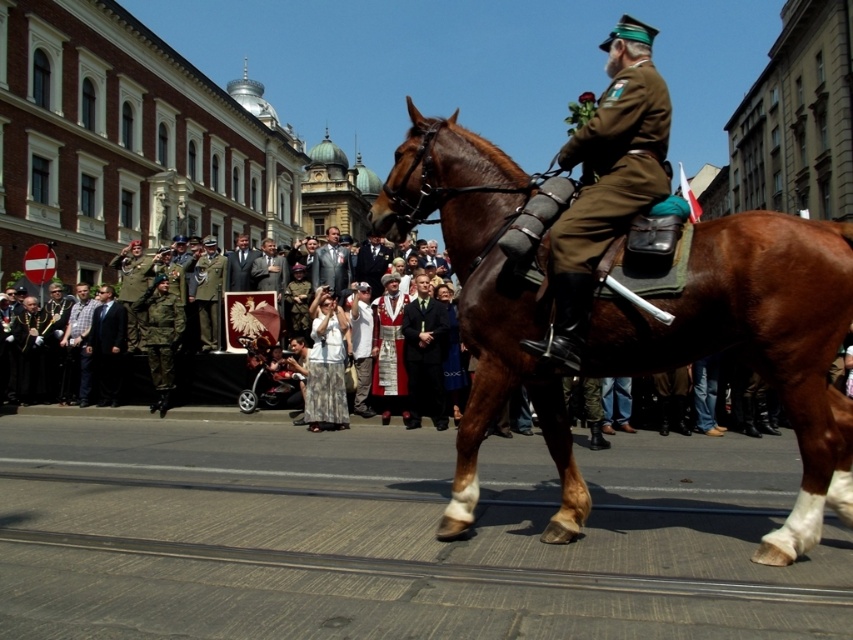
From the picture: You are standing on the sidewalk observing the mounted officer and the crowd. Which of the two points, point (463,257) or point (611,116), is closer to you?

Point (463,257) is closer to you because it is further to the viewer than point (611,116).

You are a photographer at the event and need to capture both the light brown suit at center and the dark gray suit at center in a single frame. Which suit should you position to the left to include both in the photo?

The light brown suit at center is positioned on the right side of dark gray suit at center, so to include both in the photo, you should position the dark gray suit at center to the left side of the light brown suit at center.

You are a photographer standing at the edge of the crowd. You want to take a photo that includes both the matte brown uniform at center and the light brown suit at center. Given that your camera has a maximum zoom range of 50 meters, will you be able to capture both subjects in the same frame?

The distance between the matte brown uniform at center and the light brown suit at center is 64.09 meters, which exceeds the camera maximum zoom range of 50 meters. Therefore, you cannot capture both subjects in the same frame.